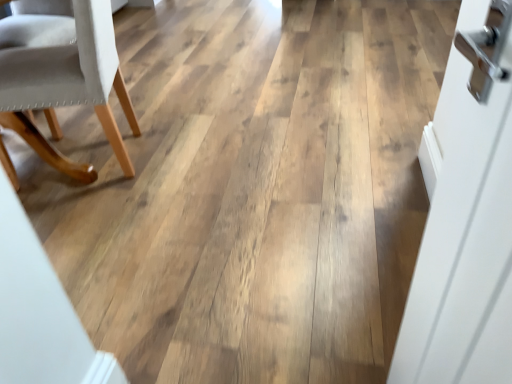
What do you see at coordinates (67, 87) in the screenshot? The image size is (512, 384). I see `light brown wood chair at left` at bounding box center [67, 87].

The width and height of the screenshot is (512, 384). In order to click on light brown wood chair at left in this screenshot , I will do `click(67, 87)`.

Find the location of `light brown wood chair at left`. light brown wood chair at left is located at coordinates (67, 87).